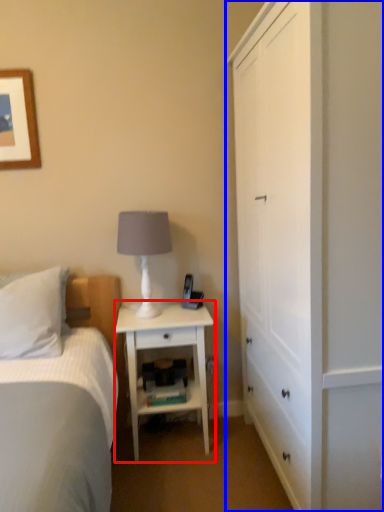
Question: Among these objects, which one is farthest to the camera, nightstand (highlighted by a red box) or cabinetry (highlighted by a blue box)?

Choices:
 (A) nightstand
 (B) cabinetry

Answer: (A)